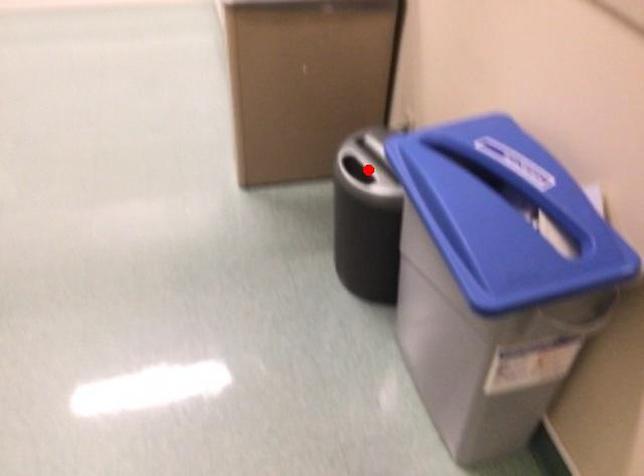
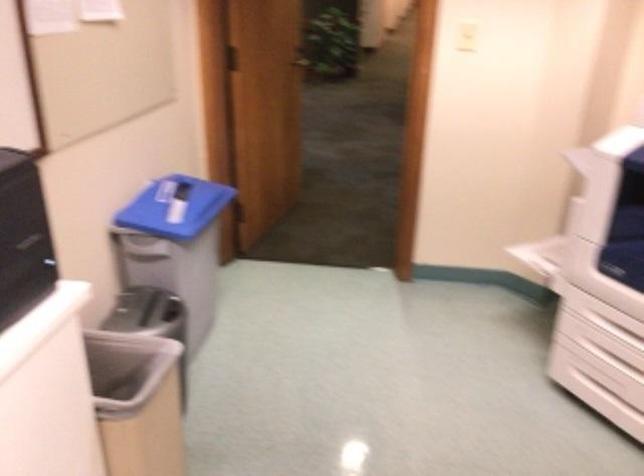
Locate, in the second image, the point that corresponds to the highlighted location in the first image.

(154, 308)